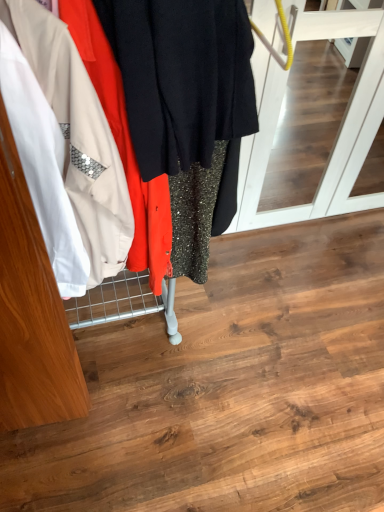
What is the approximate width of metallic sequined dress at left?

It is 23.54 inches.

Where is `metallic sequined dress at left`? metallic sequined dress at left is located at coordinates (172, 116).

The image size is (384, 512). Describe the element at coordinates (172, 116) in the screenshot. I see `metallic sequined dress at left` at that location.

At what (x,y) coordinates should I click in order to perform the action: click on matte black screen door at center. Please return your answer as a coordinate pair (x, y). Image resolution: width=384 pixels, height=512 pixels. Looking at the image, I should click on (339, 129).

The width and height of the screenshot is (384, 512). Describe the element at coordinates (339, 129) in the screenshot. I see `matte black screen door at center` at that location.

The width and height of the screenshot is (384, 512). Identify the location of metallic sequined dress at left. (172, 116).

Between matte black screen door at center and metallic sequined dress at left, which one appears on the right side from the viewer's perspective?

Positioned to the right is matte black screen door at center.

Between matte black screen door at center and metallic sequined dress at left, which one is positioned behind?

matte black screen door at center is more distant.

Looking at this image, which is nearer, (258, 172) or (132, 64)?

Clearly, point (258, 172) is more distant from the camera than point (132, 64).

From the image's perspective, is matte black screen door at center above metallic sequined dress at left?

Yes, from the image's perspective, matte black screen door at center is on top of metallic sequined dress at left.

From a real-world perspective, which is physically below, matte black screen door at center or metallic sequined dress at left?

matte black screen door at center.

Is matte black screen door at center wider than metallic sequined dress at left?

Correct, the width of matte black screen door at center exceeds that of metallic sequined dress at left.

Considering the relative sizes of matte black screen door at center and metallic sequined dress at left in the image provided, is matte black screen door at center taller than metallic sequined dress at left?

Incorrect, the height of matte black screen door at center is not larger of that of metallic sequined dress at left.

In terms of size, does matte black screen door at center appear bigger or smaller than metallic sequined dress at left?

Clearly, matte black screen door at center is larger in size than metallic sequined dress at left.

Would you say matte black screen door at center is outside metallic sequined dress at left?

Yes.

Is matte black screen door at center with metallic sequined dress at left?

matte black screen door at center and metallic sequined dress at left are not in contact.

Is matte black screen door at center facing away from metallic sequined dress at left?

No, matte black screen door at center's orientation is not away from metallic sequined dress at left.

At what (x,y) coordinates should I click in order to perform the action: click on closet below the matte black screen door at center (from the image's perspective). Please return your answer as a coordinate pair (x, y). The width and height of the screenshot is (384, 512). Looking at the image, I should click on (172, 116).

Which object is positioned more to the left, metallic sequined dress at left or matte black screen door at center?

metallic sequined dress at left is more to the left.

Which is in front, metallic sequined dress at left or matte black screen door at center?

Positioned in front is metallic sequined dress at left.

Which is closer, (193,179) or (346,19)?

Point (193,179) is closer to the camera than point (346,19).

From the picture: From the image's perspective, is metallic sequined dress at left on top of matte black screen door at center?

No, from the image's perspective, metallic sequined dress at left is not above matte black screen door at center.

From a real-world perspective, who is located lower, metallic sequined dress at left or matte black screen door at center?

matte black screen door at center, from a real-world perspective.

Does metallic sequined dress at left have a greater width compared to matte black screen door at center?

No, metallic sequined dress at left is not wider than matte black screen door at center.

Consider the image. Can you confirm if metallic sequined dress at left is taller than matte black screen door at center?

Correct, metallic sequined dress at left is much taller as matte black screen door at center.

Considering the relative sizes of metallic sequined dress at left and matte black screen door at center in the image provided, is metallic sequined dress at left smaller than matte black screen door at center?

Indeed, metallic sequined dress at left has a smaller size compared to matte black screen door at center.

Is metallic sequined dress at left not inside matte black screen door at center?

Yes, metallic sequined dress at left is located beyond the bounds of matte black screen door at center.

Does metallic sequined dress at left touch matte black screen door at center?

There is a gap between metallic sequined dress at left and matte black screen door at center.

Does metallic sequined dress at left turn towards matte black screen door at center?

No, metallic sequined dress at left does not turn towards matte black screen door at center.

How many degrees apart are the facing directions of metallic sequined dress at left and matte black screen door at center?

1.95 degrees.

Measure the distance from metallic sequined dress at left to matte black screen door at center.

They are 25.84 inches apart.

In order to click on screen door lying on the right of metallic sequined dress at left in this screenshot , I will do `click(339, 129)`.

Find the location of a particular element. closet that is below the matte black screen door at center (from the image's perspective) is located at coordinates (172, 116).

The height and width of the screenshot is (512, 384). Identify the location of closet above the matte black screen door at center (from a real-world perspective). (172, 116).